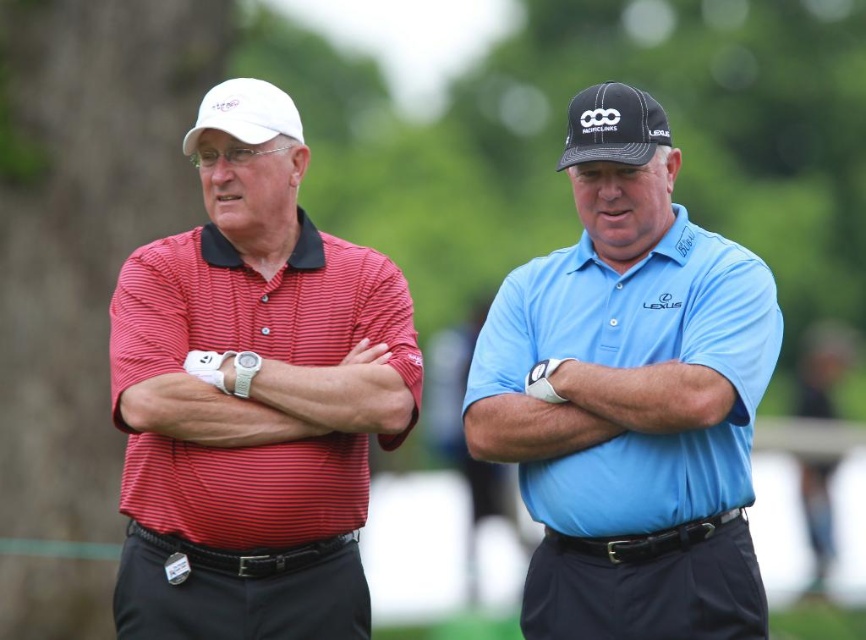
You are a photographer at a golf course event. You need to capture a photo where the blue smooth polo shirt at center and the white matte baseball cap at upper left are both visible. Based on their positions, which object should appear on the left side of the photo?

The white matte baseball cap at upper left should appear on the left side of the photo because the blue smooth polo shirt at center is positioned to the right of it.

You are a photographer trying to capture both the blue smooth polo shirt at center and the red striped shirt at left in a single frame. Based on their positions, which one should you focus on first to ensure both are in the frame?

The blue smooth polo shirt at center is located above the red striped shirt at left, so you should focus on the red striped shirt at left first to ensure both are in the frame.

You are a photographer taking a picture of two men at a golf course. You notice the black textured cap at upper center and the white matte baseball cap at upper left. Which cap is covering the other one in the photo?

The black textured cap at upper center is positioned over the white matte baseball cap at upper left, so it is covering it in the photo.